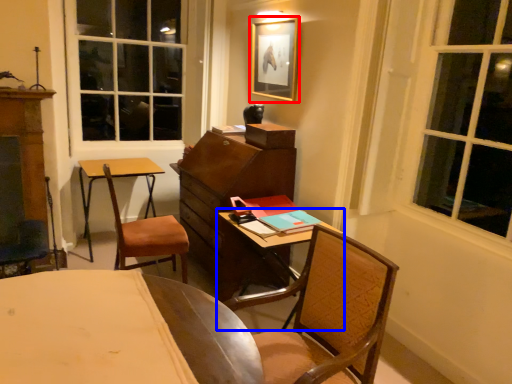
Question: Which point is further to the camera, picture frame (highlighted by a red box) or table (highlighted by a blue box)?

Choices:
 (A) picture frame
 (B) table

Answer: (A)